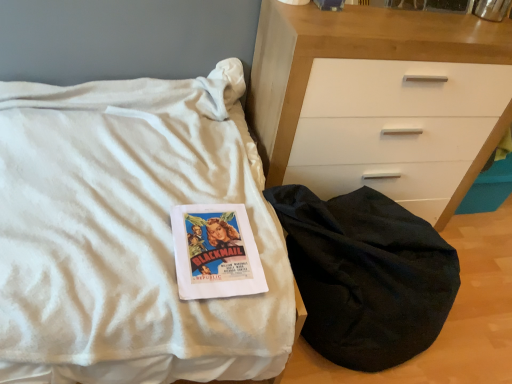
Locate an element on the screen. Image resolution: width=512 pixels, height=384 pixels. free location above white matte chest of drawers at center (from a real-world perspective) is located at coordinates (418, 16).